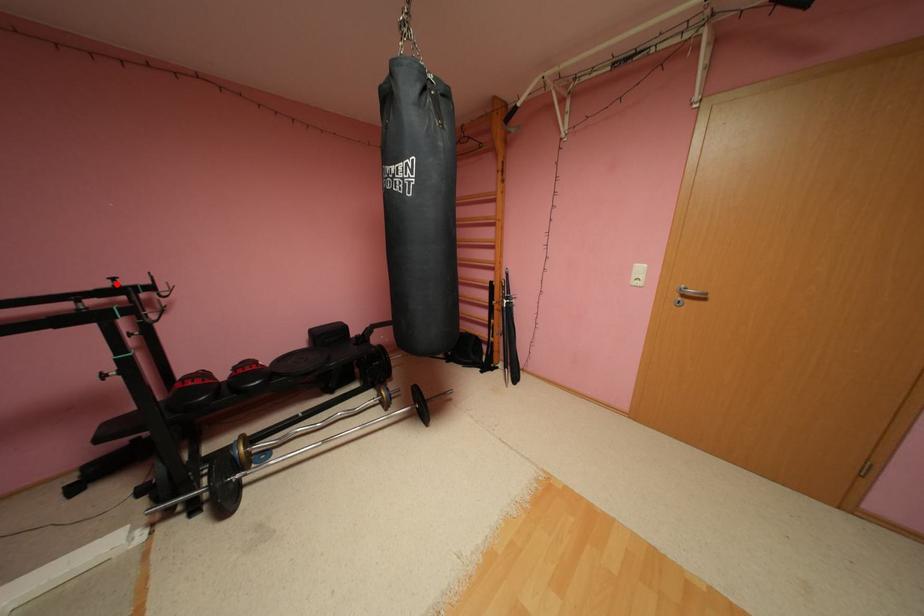
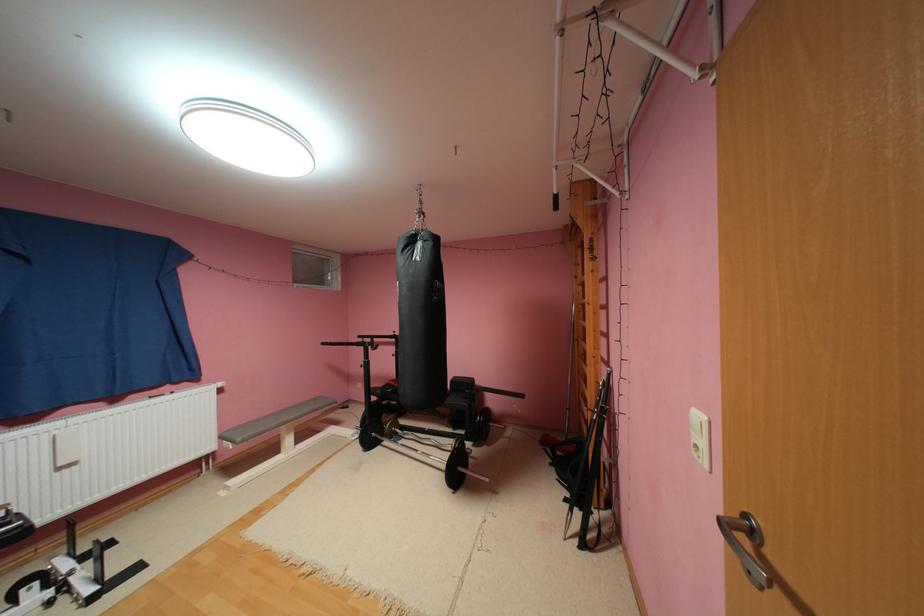
In the second image, find the point that corresponds to the highlighted location in the first image.

(400, 334)